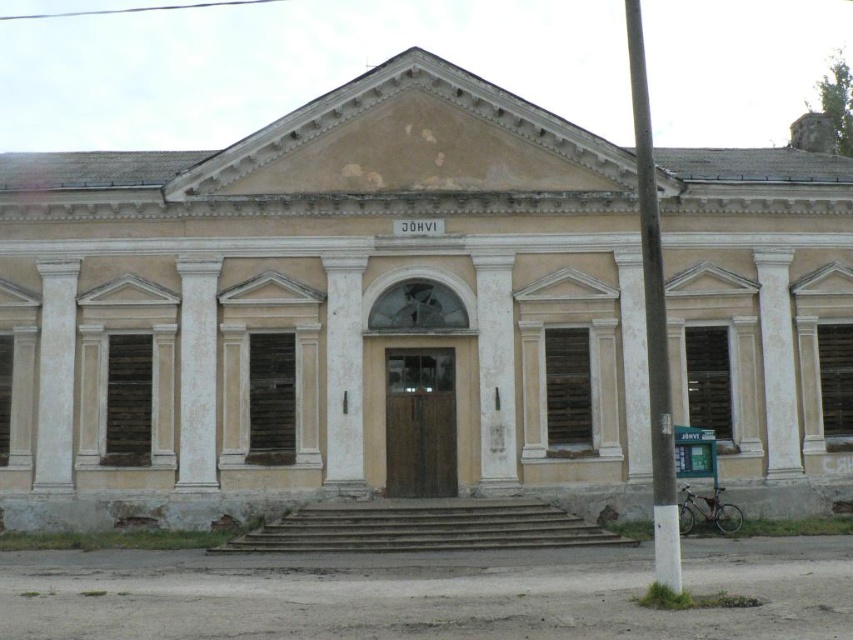
You are standing in front of the old building and notice two white structures. One is the white painted wood pole at center right and the other is the white smooth column at center. Which one is located to the right of the other?

The white painted wood pole at center right is positioned on the right side of white smooth column at center.

You are standing in front of the old building and want to place a new decorative item exactly at the center of the building. The white painted wood pole at center right is located at coordinates 0.516, 0.767. Can you determine if this pole is positioned to the left or right of the building center?

The white painted wood pole at center right is located at coordinates (653, 330). Since the building is symmetrical with its central entrance under the semi circular arched window, the center of the building would be along the vertical line at 0.5. The pole is at 0.516 on the x axis, which is slightly to the right of the central line at 0.5. Therefore, the white painted wood pole at center right is positioned to the right of the building center.

You are standing at the camera position and want to take a photo of the white smooth column at center. If your camera has a maximum focus range of 40 meters, will you be able to focus on the column?

The white smooth column at center and camera are 43.52 meters apart, which exceeds the camera maximum focus range of 40 meters. So you cannot focus on the column.